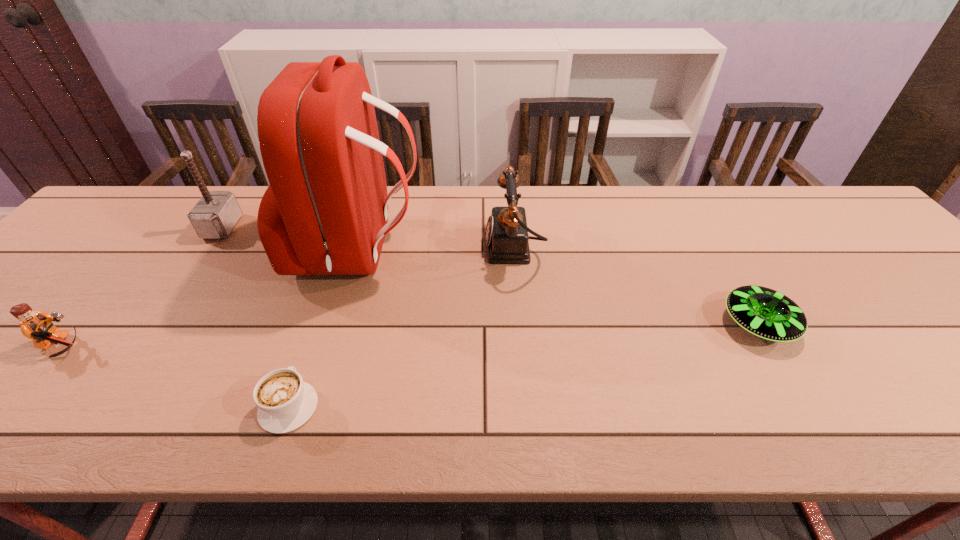
Where is `free space located on the strap side of the tallest object`? This screenshot has height=540, width=960. free space located on the strap side of the tallest object is located at coordinates (490, 252).

Locate an element on the screen. This screenshot has width=960, height=540. vacant region located 0.340m for striking with the head of the hammer is located at coordinates (358, 227).

Find the location of a particular element. The image size is (960, 540). vacant space situated 0.360m on the front of the telephone at the rotary dial is located at coordinates (349, 248).

Image resolution: width=960 pixels, height=540 pixels. Find the location of `free location located 0.240m on the front of the telephone at the rotary dial`. free location located 0.240m on the front of the telephone at the rotary dial is located at coordinates [x=395, y=248].

The image size is (960, 540). Identify the location of free space located on the front of the telephone at the rotary dial. (376, 248).

Locate an element on the screen. The image size is (960, 540). vacant space positioned 0.070m holding a crossbow in the hands of the Lego is located at coordinates (121, 347).

You are a GUI agent. You are given a task and a screenshot of the screen. Output one action in this format:
    pyautogui.click(x=<x>, y=<y>)
    Task: Click on the free spot located 0.360m on the left of the rightmost object
    Image resolution: width=960 pixels, height=540 pixels.
    Given the screenshot: What is the action you would take?
    pyautogui.click(x=562, y=325)

Identify the location of vacant region located 0.280m to the right of the shortest object's handle. The width and height of the screenshot is (960, 540). (331, 282).

The width and height of the screenshot is (960, 540). In order to click on free location located 0.210m to the right of the shortest object's handle in this screenshot , I will do `click(324, 303)`.

This screenshot has width=960, height=540. Find the location of `vacant space located to the right of the shortest object's handle`. vacant space located to the right of the shortest object's handle is located at coordinates (321, 313).